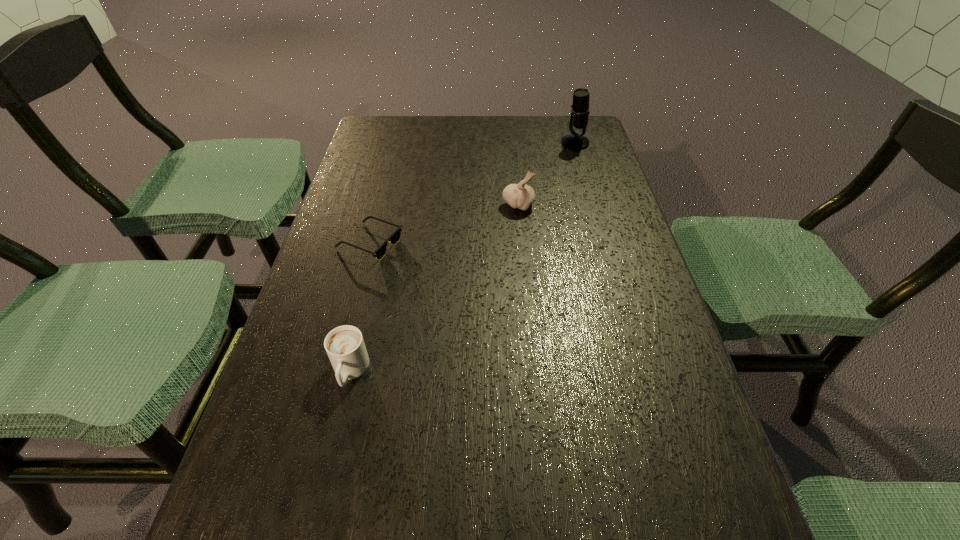
Identify the location of vacant area at the far right corner. (550, 141).

At what (x,y) coordinates should I click in order to perform the action: click on vacant region between the third farthest object and the third nearest object. Please return your answer as a coordinate pair (x, y). Looking at the image, I should click on (444, 224).

The height and width of the screenshot is (540, 960). In order to click on unoccupied position between the sunglasses and the third tallest object in this screenshot , I will do `click(360, 307)`.

Locate an element on the screen. vacant region between the second shortest object and the microphone is located at coordinates (463, 258).

At what (x,y) coordinates should I click in order to perform the action: click on vacant space that's between the second nearest object and the rightmost object. Please return your answer as a coordinate pair (x, y). Looking at the image, I should click on (x=472, y=193).

Locate an element on the screen. free space between the second farthest object and the tallest object is located at coordinates (546, 174).

What are the coordinates of `free space between the sunglasses and the second shortest object` in the screenshot? It's located at (360, 307).

Locate an element on the screen. The width and height of the screenshot is (960, 540). empty location between the nearest object and the shortest object is located at coordinates (360, 307).

Find the location of a particular element. vacant space that is in between the third object from left to right and the cappuccino is located at coordinates (434, 288).

The height and width of the screenshot is (540, 960). I want to click on free spot between the cappuccino and the tallest object, so click(x=463, y=258).